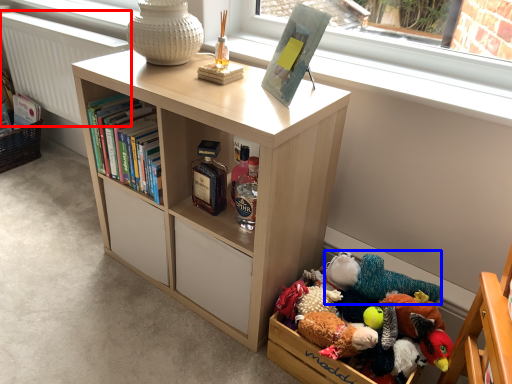
Question: Which object appears closest to the camera in this image, radiator (highlighted by a red box) or toy (highlighted by a blue box)?

Choices:
 (A) radiator
 (B) toy

Answer: (B)